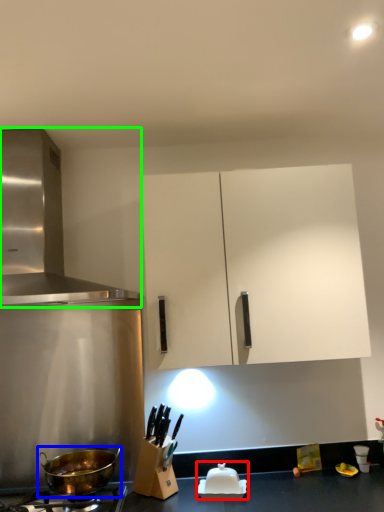
Question: Which object is the closest to the appliance (highlighted by a red box)? Choose among these: wok (highlighted by a blue box) or kitchen appliance (highlighted by a green box).

Choices:
 (A) wok
 (B) kitchen appliance

Answer: (A)